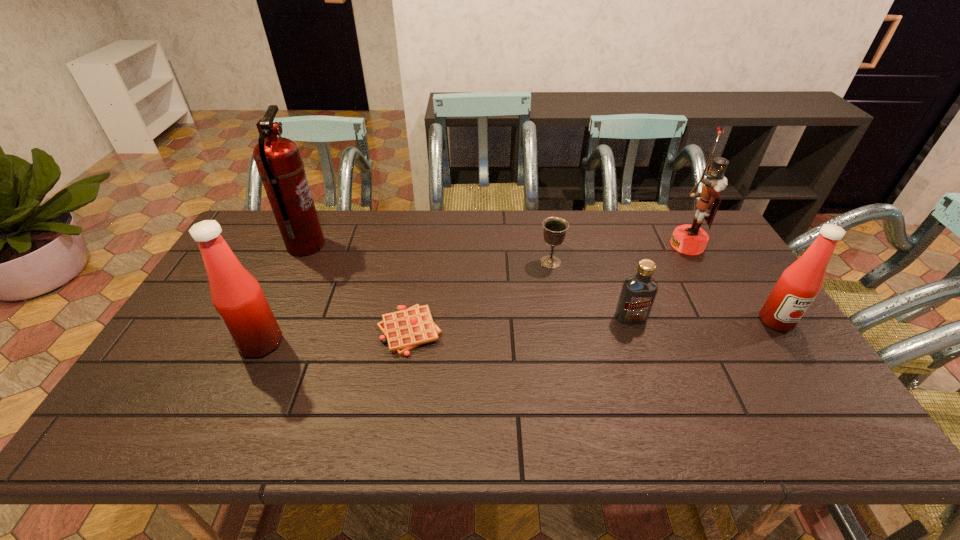
Please mark a free spot for a new condiment to balance the arrangement. Please provide its 2D coordinates. Your answer should be formatted as a tuple, i.e. [(x, y)], where the tuple contains the x and y coordinates of a point satisfying the conditions above.

[(525, 332)]